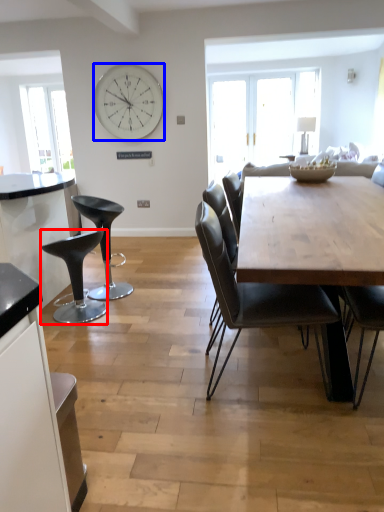
Question: Which point is closer to the camera, stool (highlighted by a red box) or wall clock (highlighted by a blue box)?

Choices:
 (A) stool
 (B) wall clock

Answer: (A)